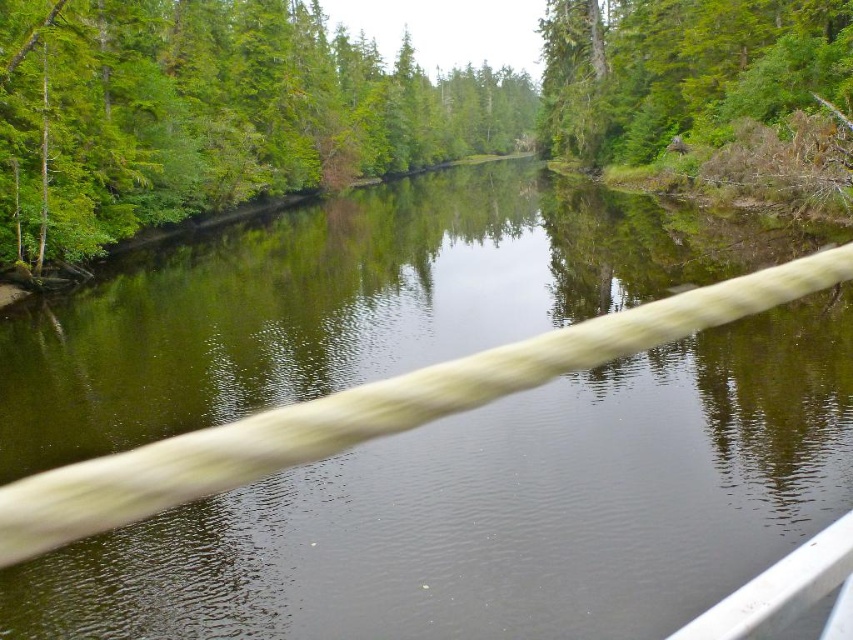
Question: Which object is closer to the camera taking this photo?

Choices:
 (A) green rough bark tree at upper right
 (B) green leafy tree at upper left

Answer: (B)

Question: Can you confirm if green leafy tree at upper left is positioned to the right of green rough bark tree at upper right?

Choices:
 (A) no
 (B) yes

Answer: (A)

Question: Can you confirm if green leafy tree at upper left is positioned to the left of green rough bark tree at upper right?

Choices:
 (A) yes
 (B) no

Answer: (A)

Question: Where is green leafy tree at upper left located in relation to green rough bark tree at upper right in the image?

Choices:
 (A) left
 (B) right

Answer: (A)

Question: Which of the following is the farthest from the observer?

Choices:
 (A) (602, 122)
 (B) (360, 90)

Answer: (B)